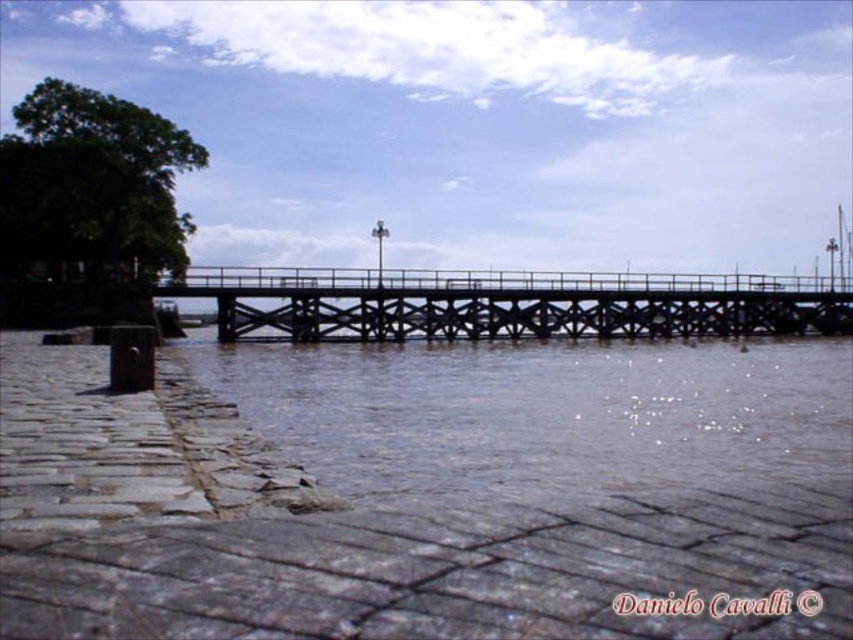
Question: Which object appears closest to the camera in this image?

Choices:
 (A) brown/muddy water at center
 (B) black metal bridge at center

Answer: (A)

Question: Can you confirm if brown/muddy water at center is positioned to the right of black metal bridge at center?

Choices:
 (A) yes
 (B) no

Answer: (B)

Question: Does brown/muddy water at center have a larger size compared to black metal bridge at center?

Choices:
 (A) yes
 (B) no

Answer: (A)

Question: Can you confirm if brown/muddy water at center is smaller than black metal bridge at center?

Choices:
 (A) no
 (B) yes

Answer: (A)

Question: Which of the following is the closest to the observer?

Choices:
 (A) black metal bridge at center
 (B) brown/muddy water at center

Answer: (B)